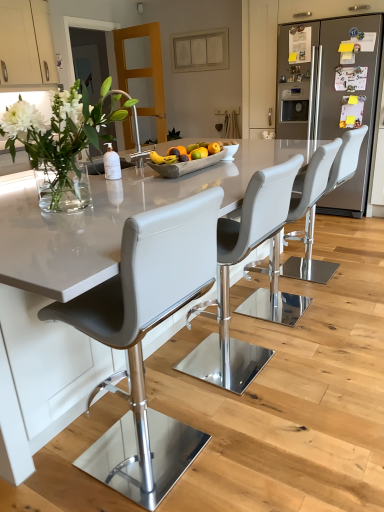
The width and height of the screenshot is (384, 512). What are the coordinates of `white leather bar stool at center, placed as the first chair when sorted from back to front` in the screenshot? It's located at (x=307, y=258).

Describe the element at coordinates (228, 278) in the screenshot. I see `white leather bar stool at center, the second chair in the front-to-back sequence` at that location.

The image size is (384, 512). I want to click on matte white cabinet at upper left, so click(x=26, y=42).

The height and width of the screenshot is (512, 384). In order to click on gray leather bar stool at center, the 2th chair in the back-to-front sequence in this screenshot , I will do pos(257,223).

Measure the distance between gray leather bar stool at center, the 2th chair in the back-to-front sequence, and camera.

gray leather bar stool at center, the 2th chair in the back-to-front sequence, is 4.88 feet from camera.

At what (x,y) coordinates should I click in order to perform the action: click on white glossy table at center. Please return your answer as a coordinate pair (x, y). The image size is (384, 512). Looking at the image, I should click on (108, 219).

Looking at this image, relative to yellow matte bananas at center, is gray leather bar stool at center, the 2th chair in the back-to-front sequence, in front or behind?

gray leather bar stool at center, the 2th chair in the back-to-front sequence, is positioned farther from the viewer than yellow matte bananas at center.

Is point (276, 167) closer to viewer compared to point (153, 154)?

Yes, point (276, 167) is closer to viewer.

Identify the location of chair that is the 4th one below the yellow matte bananas at center (from a real-world perspective). (257, 223).

From the picture: Which is closer, (321, 271) or (257, 241)?

Point (321, 271) is farther from the camera than point (257, 241).

Does white leather bar stool at center, acting as the fourth chair starting from the front, lie in front of gray leather bar stool at center, the 2th chair in the back-to-front sequence?

No, white leather bar stool at center, acting as the fourth chair starting from the front, is further to the viewer.

Is white leather bar stool at center, acting as the fourth chair starting from the front, taller or shorter than gray leather bar stool at center, the third chair when ordered from front to back?

Clearly, white leather bar stool at center, acting as the fourth chair starting from the front, is taller compared to gray leather bar stool at center, the third chair when ordered from front to back.

From the image's perspective, which one is positioned lower, white leather bar stool at center, acting as the fourth chair starting from the front, or gray leather bar stool at center, the 2th chair in the back-to-front sequence?

gray leather bar stool at center, the 2th chair in the back-to-front sequence, from the image's perspective.

Is point (133, 408) less distant than point (155, 344)?

That is True.

Is matte gray chair at center, acting as the 1th chair starting from the front, closer to camera compared to white glossy table at center?

No, it is not.

Considering the sizes of objects matte gray chair at center, which ranks as the fourth chair in back-to-front order, and white glossy table at center in the image provided, who is thinner, matte gray chair at center, which ranks as the fourth chair in back-to-front order, or white glossy table at center?

matte gray chair at center, which ranks as the fourth chair in back-to-front order, is thinner.

Is matte gray chair at center, acting as the 1th chair starting from the front, looking in the opposite direction of white glossy table at center?

Yes, white glossy table at center is at the back of matte gray chair at center, acting as the 1th chair starting from the front.

Considering the relative sizes of satin silver refrigerator at right and white glossy table at center in the image provided, is satin silver refrigerator at right shorter than white glossy table at center?

In fact, satin silver refrigerator at right may be taller than white glossy table at center.

In terms of size, does satin silver refrigerator at right appear bigger or smaller than white glossy table at center?

Considering their sizes, satin silver refrigerator at right takes up less space than white glossy table at center.

Does satin silver refrigerator at right turn towards white glossy table at center?

Yes, satin silver refrigerator at right is oriented towards white glossy table at center.

From the image's perspective, relative to white glossy table at center, is satin silver refrigerator at right above or below?

satin silver refrigerator at right is above white glossy table at center.

Find the location of `kitchen & dining room table on the right of the clear glass vase at left`. kitchen & dining room table on the right of the clear glass vase at left is located at coordinates (108, 219).

Is white glossy table at center looking in the opposite direction of clear glass vase at left?

No, white glossy table at center is not facing the opposite direction of clear glass vase at left.

From the image's perspective, is white glossy table at center above or below clear glass vase at left?

Clearly, from the image's perspective, white glossy table at center is below clear glass vase at left.

Considering the relative positions of white glossy table at center and clear glass vase at left in the image provided, is white glossy table at center to the right of clear glass vase at left from the viewer's perspective?

Yes.

Is matte gray chair at center, which ranks as the fourth chair in back-to-front order, aimed at yellow matte bananas at center?

No, matte gray chair at center, which ranks as the fourth chair in back-to-front order, does not turn towards yellow matte bananas at center.

Between point (143, 435) and point (165, 162), which one is positioned behind?

The point (165, 162) is more distant.

Considering their positions, is matte gray chair at center, which ranks as the fourth chair in back-to-front order, located in front of or behind yellow matte bananas at center?

matte gray chair at center, which ranks as the fourth chair in back-to-front order, is positioned closer to the viewer than yellow matte bananas at center.

Which of these two, matte gray chair at center, which ranks as the fourth chair in back-to-front order, or yellow matte bananas at center, stands taller?

matte gray chair at center, which ranks as the fourth chair in back-to-front order.

Does gray leather bar stool at center, the 2th chair in the back-to-front sequence, touch white leather bar stool at center, the 3th chair when ordered from back to front?

No, gray leather bar stool at center, the 2th chair in the back-to-front sequence, is not with white leather bar stool at center, the 3th chair when ordered from back to front.

Who is shorter, gray leather bar stool at center, the 2th chair in the back-to-front sequence, or white leather bar stool at center, the second chair in the front-to-back sequence?

With less height is gray leather bar stool at center, the 2th chair in the back-to-front sequence.

Considering the relative positions of gray leather bar stool at center, the 2th chair in the back-to-front sequence, and white leather bar stool at center, the 3th chair when ordered from back to front, in the image provided, is gray leather bar stool at center, the 2th chair in the back-to-front sequence, to the right of white leather bar stool at center, the 3th chair when ordered from back to front, from the viewer's perspective?

Indeed, gray leather bar stool at center, the 2th chair in the back-to-front sequence, is positioned on the right side of white leather bar stool at center, the 3th chair when ordered from back to front.

From the image's perspective, is gray leather bar stool at center, the 2th chair in the back-to-front sequence, under white leather bar stool at center, the second chair in the front-to-back sequence?

Incorrect, from the image's perspective, gray leather bar stool at center, the 2th chair in the back-to-front sequence, is higher than white leather bar stool at center, the second chair in the front-to-back sequence.

From a real-world perspective, which chair is the 4th one underneath the yellow matte bananas at center? Please provide its 2D coordinates.

[(257, 223)]

Image resolution: width=384 pixels, height=512 pixels. In order to click on chair behind the gray leather bar stool at center, the 2th chair in the back-to-front sequence in this screenshot , I will do `click(307, 258)`.

Considering their positions, is yellow matte bananas at center positioned closer to white glossy table at center than satin silver refrigerator at right?

Among the two, yellow matte bananas at center is located nearer to white glossy table at center.

When comparing their distances from clear glass vase at left, does yellow matte bananas at center or matte white cabinet at upper left seem closer?

yellow matte bananas at center.

Looking at the image, which one is located further to white glossy table at center, white leather bar stool at center, acting as the fourth chair starting from the front, or satin silver refrigerator at right?

satin silver refrigerator at right is positioned further to the anchor white glossy table at center.

Based on their spatial positions, is satin silver refrigerator at right or clear glass vase at left further from matte white cabinet at upper left?

satin silver refrigerator at right is positioned further to the anchor matte white cabinet at upper left.

Estimate the real-world distances between objects in this image. Which object is further from clear glass vase at left, matte white cabinet at upper left or white glossy table at center?

Answer: Based on the image, matte white cabinet at upper left appears to be further to clear glass vase at left.

Which object lies further to the anchor point gray leather bar stool at center, the 2th chair in the back-to-front sequence, satin silver refrigerator at right or white leather bar stool at center, the second chair in the front-to-back sequence?

satin silver refrigerator at right lies further to gray leather bar stool at center, the 2th chair in the back-to-front sequence, than the other object.

Based on their spatial positions, is matte gray chair at center, acting as the 1th chair starting from the front, or matte white cabinet at upper left closer to white leather bar stool at center, acting as the fourth chair starting from the front?

The object closer to white leather bar stool at center, acting as the fourth chair starting from the front, is matte gray chair at center, acting as the 1th chair starting from the front.

Looking at the image, which one is located closer to white leather bar stool at center, the second chair in the front-to-back sequence, yellow matte bananas at center or white glossy table at center?

white glossy table at center is positioned closer to the anchor white leather bar stool at center, the second chair in the front-to-back sequence.

Where is `chair between gray leather bar stool at center, the third chair when ordered from front to back, and satin silver refrigerator at right from front to back`? Image resolution: width=384 pixels, height=512 pixels. chair between gray leather bar stool at center, the third chair when ordered from front to back, and satin silver refrigerator at right from front to back is located at coordinates (307, 258).

Locate an element on the screen. fruit between matte white cabinet at upper left and white leather bar stool at center, the second chair in the front-to-back sequence, from top to bottom is located at coordinates (163, 158).

The height and width of the screenshot is (512, 384). I want to click on floral arrangement located between matte white cabinet at upper left and white leather bar stool at center, acting as the fourth chair starting from the front, in the left-right direction, so click(x=59, y=139).

You are a GUI agent. You are given a task and a screenshot of the screen. Output one action in this format:
    pyautogui.click(x=<x>, y=<y>)
    Task: Click on the floral arrangement located between matte gray chair at center, which ranks as the fourth chair in back-to-front order, and yellow matte bananas at center in the depth direction
    
    Given the screenshot: What is the action you would take?
    pyautogui.click(x=59, y=139)